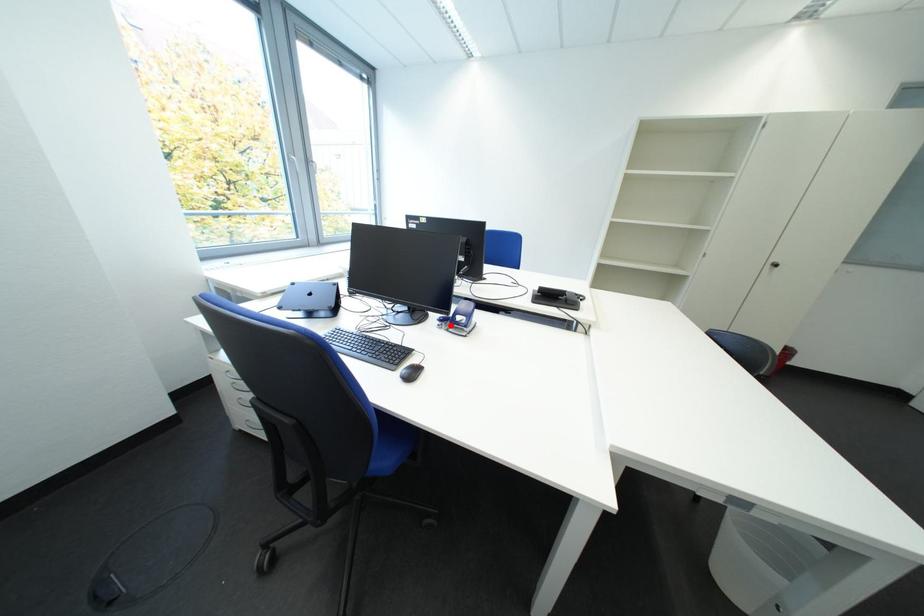
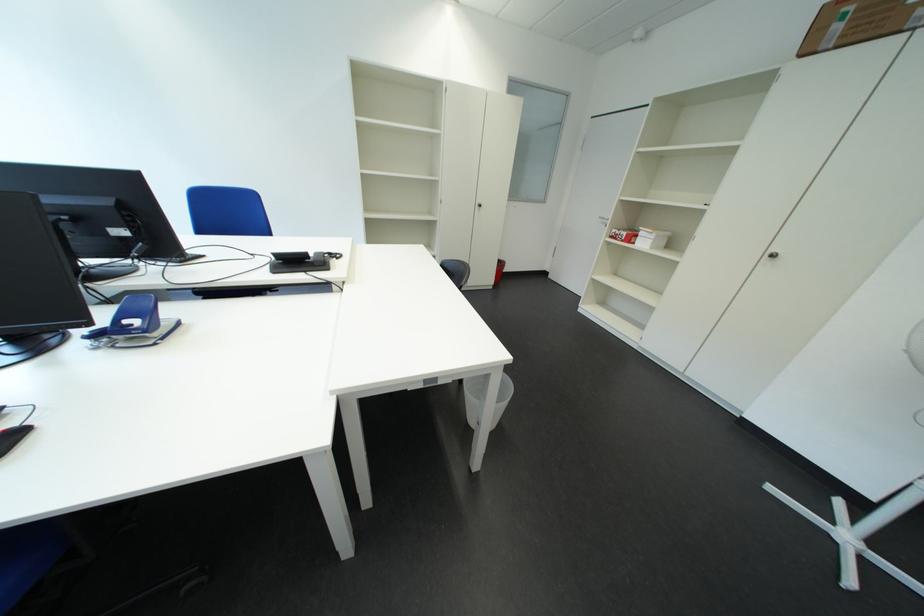
The point at the highlighted location is marked in the first image. Where is the corresponding point in the second image?

(101, 344)